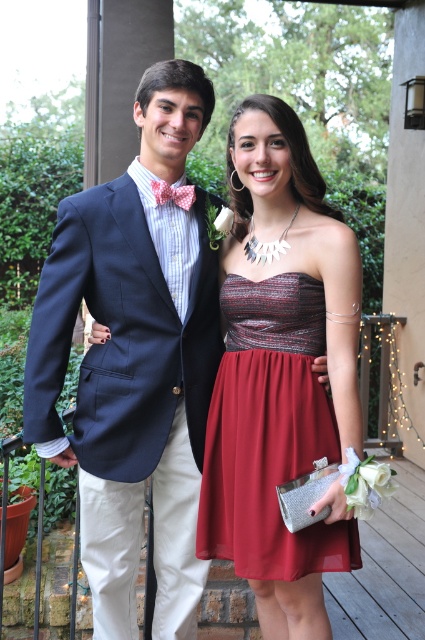
The image size is (425, 640). Describe the element at coordinates (135, 360) in the screenshot. I see `matte black blazer at upper left` at that location.

In the scene shown: Does matte black blazer at upper left appear over pink dotted bow tie at upper center?

No, matte black blazer at upper left is not above pink dotted bow tie at upper center.

Image resolution: width=425 pixels, height=640 pixels. What do you see at coordinates (135, 360) in the screenshot? I see `matte black blazer at upper left` at bounding box center [135, 360].

Locate an element on the screen. matte black blazer at upper left is located at coordinates (135, 360).

Is shiny red chiffon dress at center bigger than pink dotted bow tie at upper center?

Correct, shiny red chiffon dress at center is larger in size than pink dotted bow tie at upper center.

Who is positioned more to the left, shiny red chiffon dress at center or pink dotted bow tie at upper center?

From the viewer's perspective, pink dotted bow tie at upper center appears more on the left side.

Does point (252, 435) come behind point (186, 208)?

That is False.

Where is `shiny red chiffon dress at center`? shiny red chiffon dress at center is located at coordinates (269, 433).

Can you confirm if matte black blazer at upper left is taller than shiny red chiffon dress at center?

Yes.

What do you see at coordinates (135, 360) in the screenshot?
I see `matte black blazer at upper left` at bounding box center [135, 360].

Identify the location of matte black blazer at upper left. (135, 360).